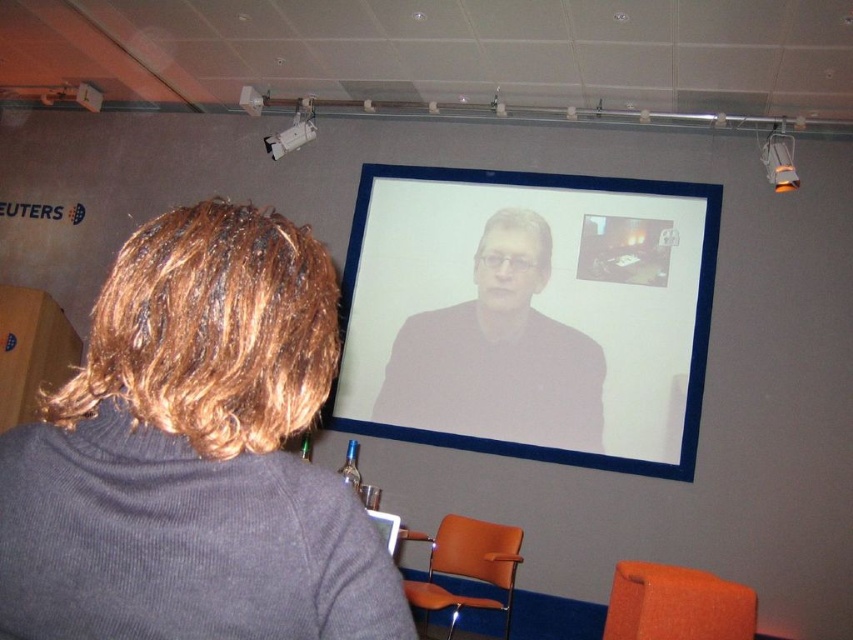
You are a delivery person who needs to place a 12 feet long package between the gray ribbed sweater at lower left and the white plastic projector at upper center. Can you fit the package between them?

The distance between the gray ribbed sweater at lower left and the white plastic projector at upper center is 15.08 feet, which is greater than the 12 feet length of the package. Therefore, the package can be placed between them.

You are a delivery robot that needs to place a package between the gray ribbed sweater at lower left and the orange fabric chair at lower right. The package is 2 meters wide. Will it fit in the space between them?

The gray ribbed sweater at lower left and orange fabric chair at lower right are 2.30 meters apart from each other. Since the package is 2 meters wide, it will fit in the space between them as the distance is greater than the package width.

You are the person seated in the conference room and want to click on the point at coordinates point (572, 396) while avoiding moving your cursor over point (277, 154). Is this possible?

Yes, because point (572, 396) is in front of point (277, 154), so you can move the cursor directly to the desired point without crossing over the other point.